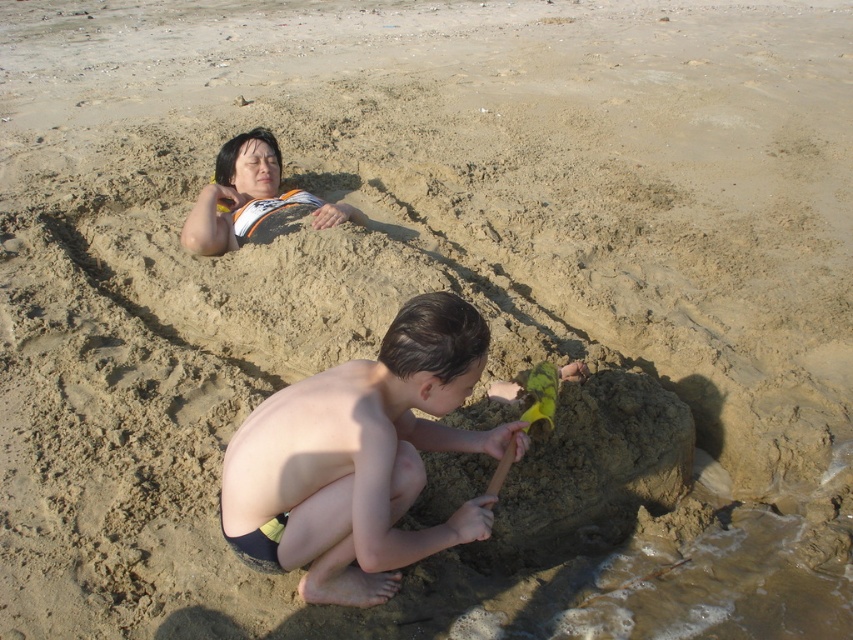
Can you confirm if smooth tan skin at center is thinner than orange and white t-shirt at upper left?

Yes.

The height and width of the screenshot is (640, 853). In order to click on smooth tan skin at center in this screenshot , I will do `click(358, 460)`.